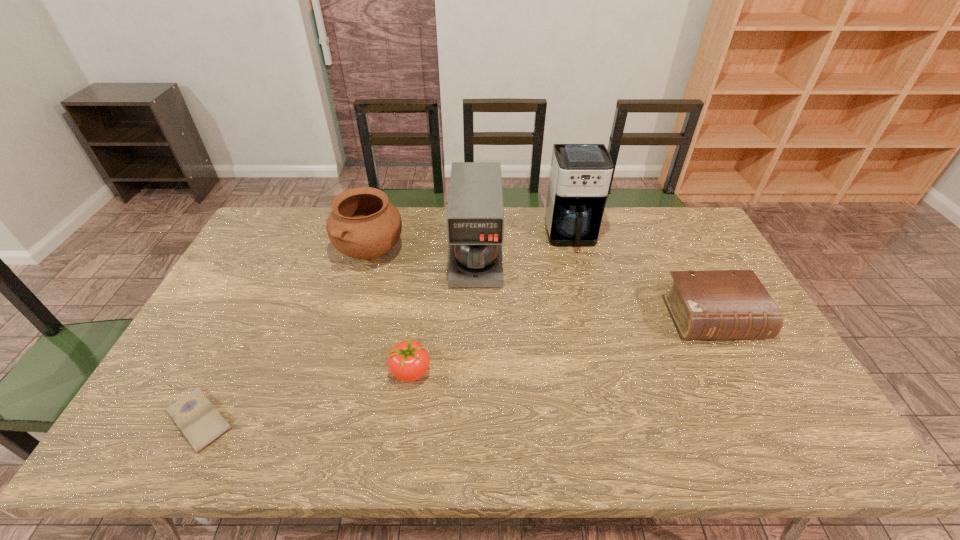
Locate an element on the screen. free space that satisfies the following two spatial constraints: 1. on the back side of the fourth object from right to left; 2. on the left side of the leftmost object is located at coordinates (224, 372).